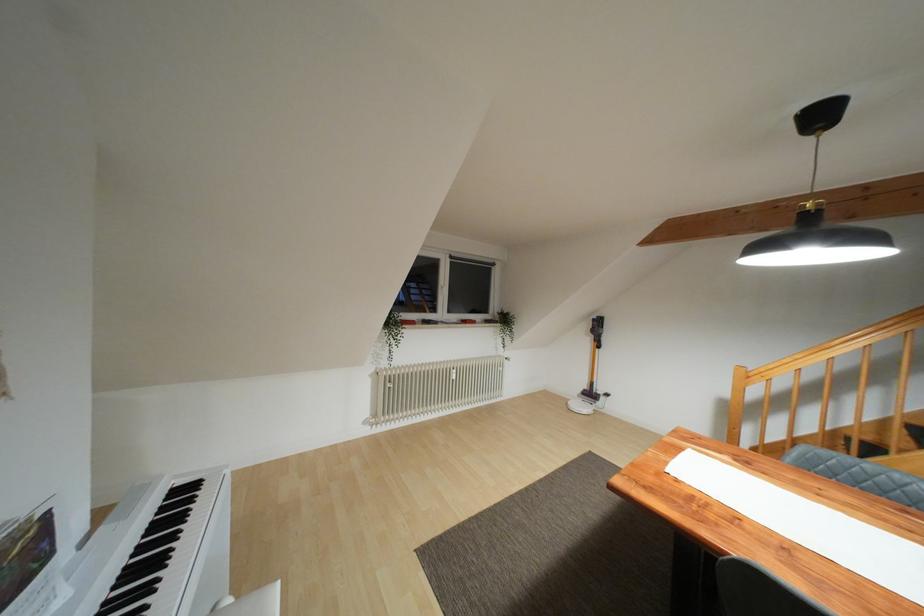
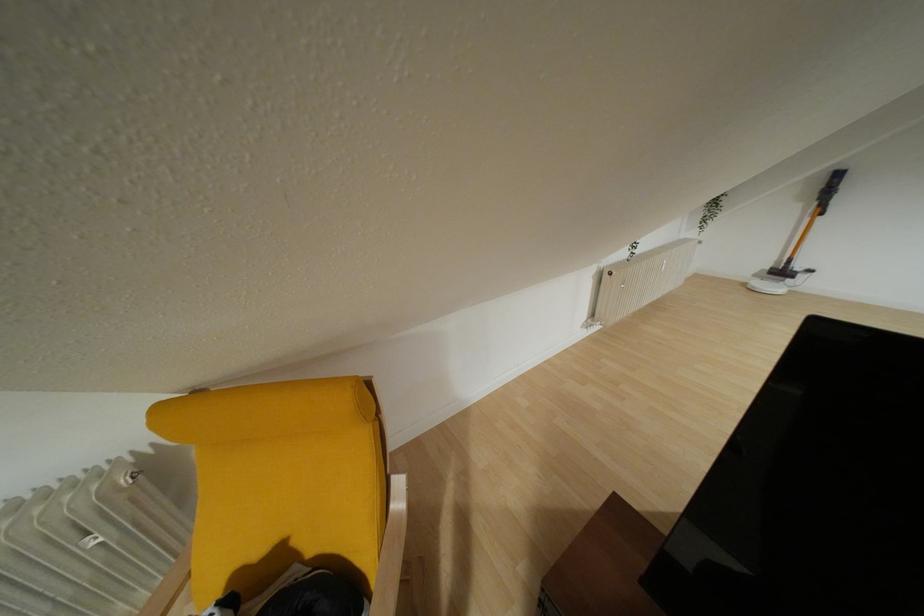
Question: In a continuous first-person perspective shot, in which direction is the camera moving?

Choices:
 (A) Left
 (B) Right
 (C) Forward
 (D) Backward

Answer: (A)